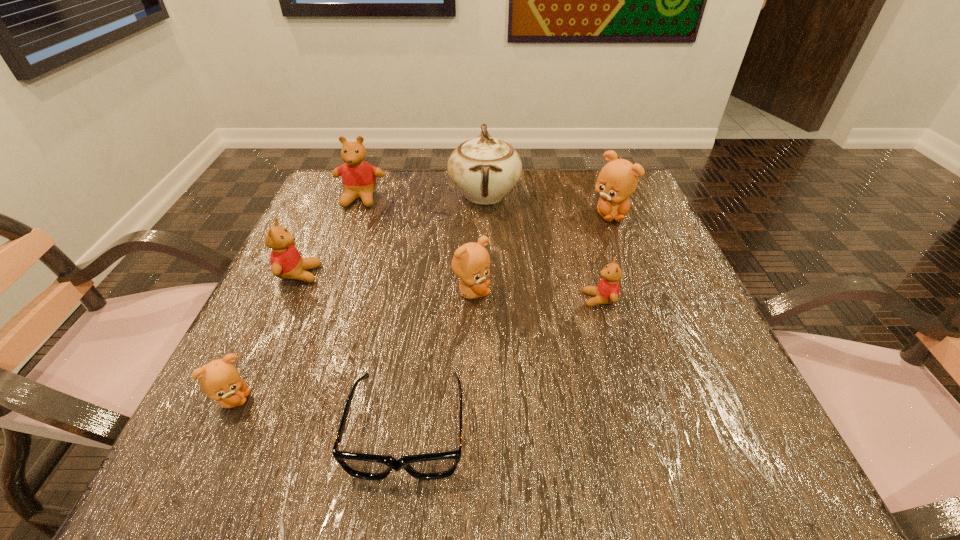
Image resolution: width=960 pixels, height=540 pixels. I want to click on chinaware, so click(484, 169).

Image resolution: width=960 pixels, height=540 pixels. Find the location of `the biggest red teddy bear`. the biggest red teddy bear is located at coordinates (358, 177).

Where is `the rightmost object`? The image size is (960, 540). the rightmost object is located at coordinates (618, 179).

Find the location of a particular element. The image size is (960, 540). the biggest brown teddy bear is located at coordinates (618, 179).

I want to click on the second smallest red teddy bear, so [x=286, y=262].

At what (x,y) coordinates should I click in order to perform the action: click on the second nearest brown teddy bear. Please return your answer as a coordinate pair (x, y). This screenshot has width=960, height=540. Looking at the image, I should click on (471, 262).

Locate an element on the screen. the second biggest brown teddy bear is located at coordinates (471, 262).

The image size is (960, 540). I want to click on the leftmost brown teddy bear, so click(220, 380).

You are a GUI agent. You are given a task and a screenshot of the screen. Output one action in this format:
    pyautogui.click(x=<x>, y=<y>)
    Task: Click on the nearest brown teddy bear
    The image size is (960, 540).
    Given the screenshot: What is the action you would take?
    pyautogui.click(x=220, y=380)

The width and height of the screenshot is (960, 540). Find the location of `the smallest red teddy bear`. the smallest red teddy bear is located at coordinates (607, 292).